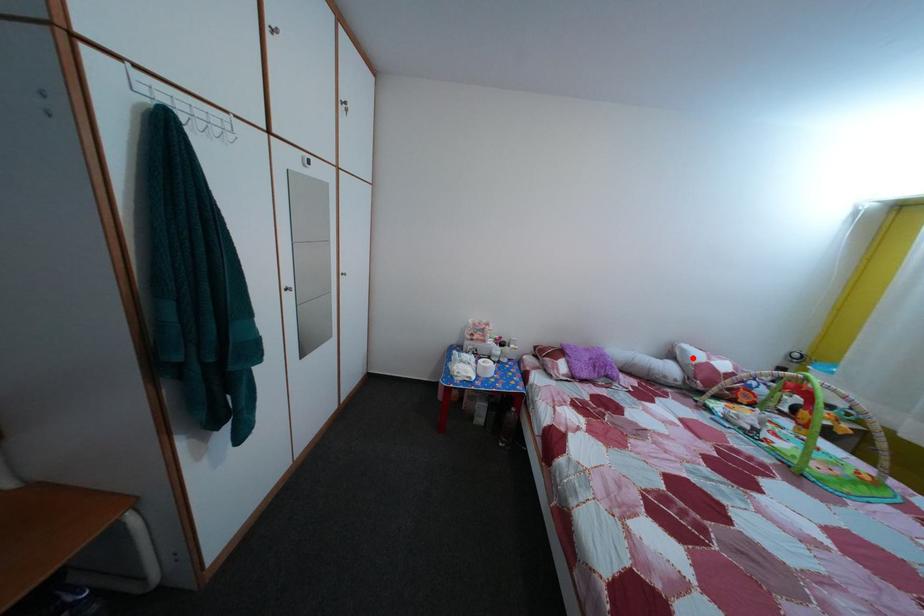
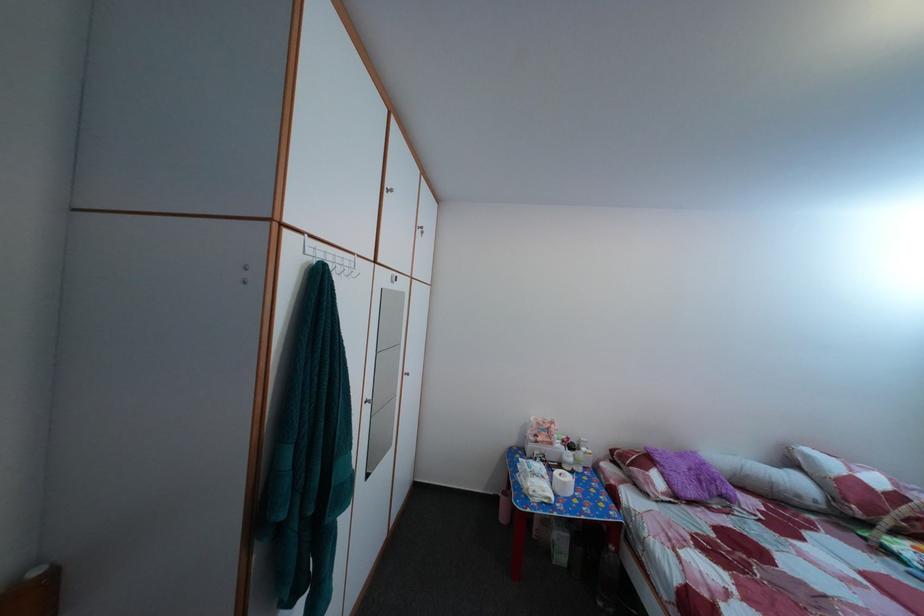
Where in the second image is the point corresponding to the highlighted location from the first image?

(817, 464)